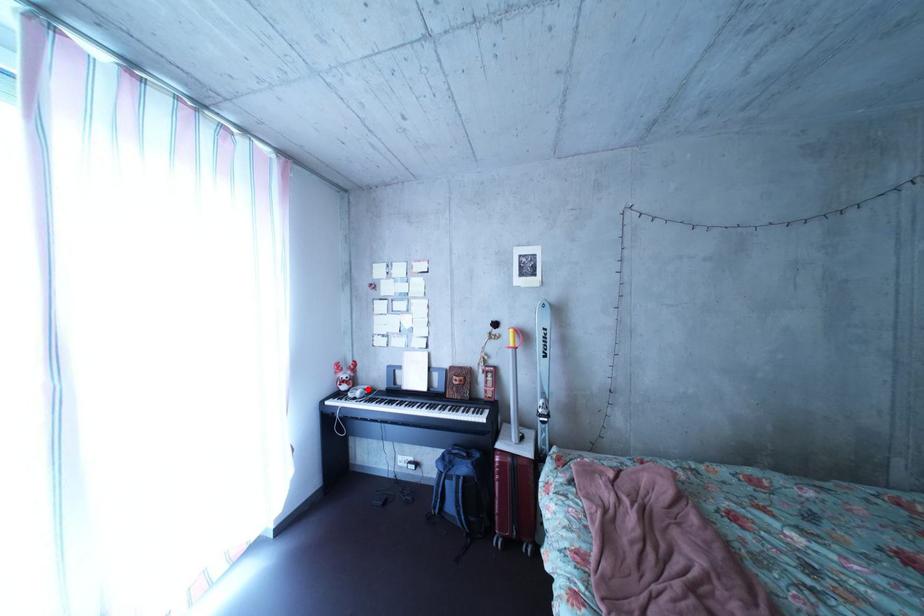
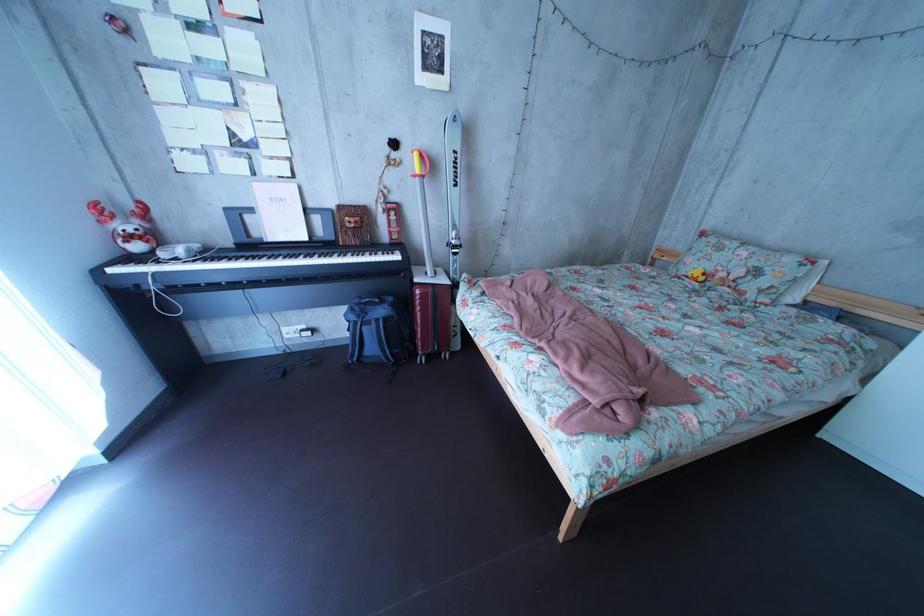
The point at the highlighted location is marked in the first image. Where is the corresponding point in the second image?

(169, 246)